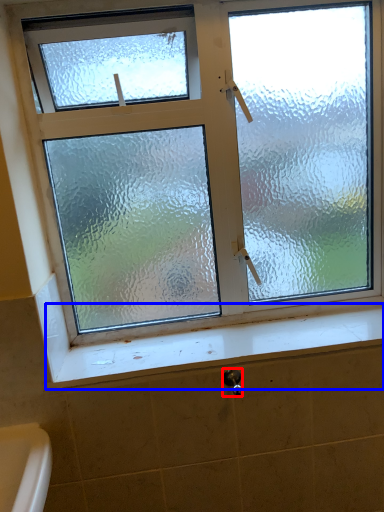
Question: Which object appears farthest to the camera in this image, shower (highlighted by a red box) or window sill (highlighted by a blue box)?

Choices:
 (A) shower
 (B) window sill

Answer: (B)